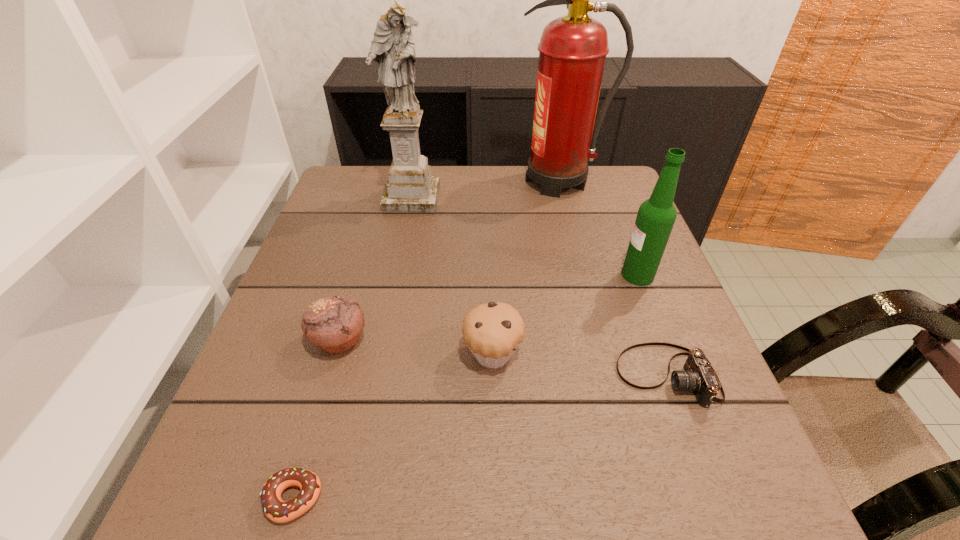
Find the location of a particular element. blank region between the fire extinguisher and the sculpture is located at coordinates (486, 189).

Where is `free point between the doughnut and the fire extinguisher`? This screenshot has width=960, height=540. free point between the doughnut and the fire extinguisher is located at coordinates (426, 340).

Where is `vacant space that is in between the left muffin and the doughnut`? vacant space that is in between the left muffin and the doughnut is located at coordinates 316,420.

Locate an element on the screen. The image size is (960, 540). vacant area that lies between the sculpture and the left muffin is located at coordinates (375, 269).

Image resolution: width=960 pixels, height=540 pixels. In order to click on blank region between the right muffin and the fifth nearest object in this screenshot , I will do click(565, 315).

Where is `free spot between the camera and the third tallest object`? This screenshot has height=540, width=960. free spot between the camera and the third tallest object is located at coordinates (652, 326).

The width and height of the screenshot is (960, 540). What are the coordinates of `unoccupied position between the doughnut and the left muffin` in the screenshot? It's located at (316, 420).

Where is `unoccupied area between the fire extinguisher and the sculpture`? Image resolution: width=960 pixels, height=540 pixels. unoccupied area between the fire extinguisher and the sculpture is located at coordinates (486, 189).

Identify the location of blank region between the right muffin and the left muffin. (417, 348).

Find the location of a particular element. Image resolution: width=960 pixels, height=540 pixels. the closest object to the right muffin is located at coordinates (699, 376).